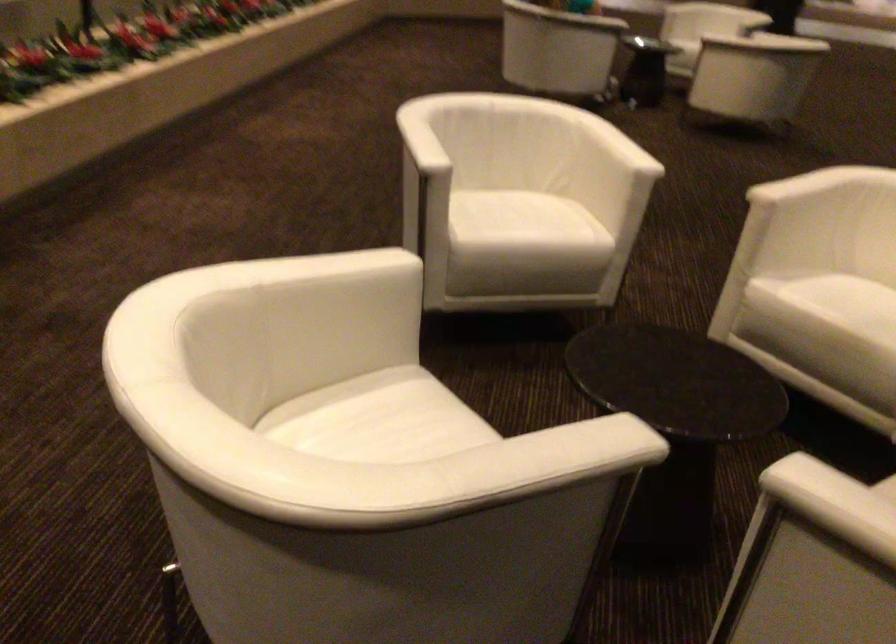
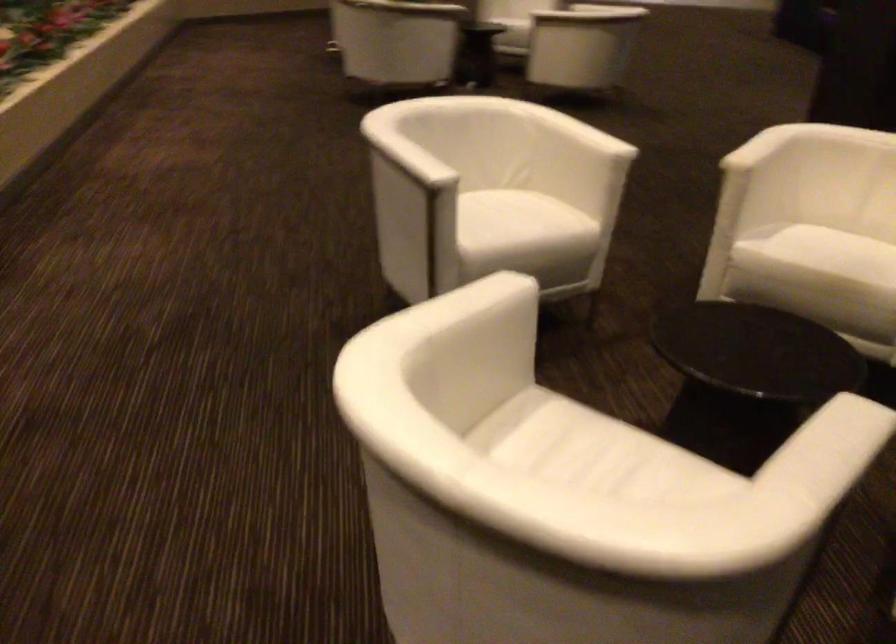
Locate, in the second image, the point that corresponds to point (431, 444) in the first image.

(616, 462)